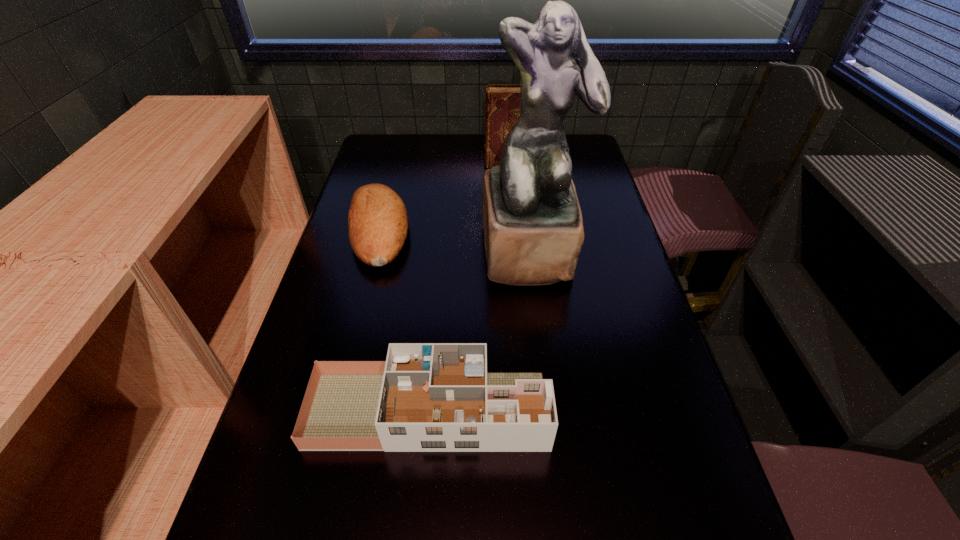
This screenshot has height=540, width=960. I want to click on vacant space located 0.260m on the back of the bread, so click(x=398, y=155).

In order to click on object that is at the far edge in this screenshot , I will do `click(503, 107)`.

I want to click on dollhouse situated at the left edge, so click(x=426, y=397).

Image resolution: width=960 pixels, height=540 pixels. Find the location of `bread that is at the left edge`. bread that is at the left edge is located at coordinates (377, 220).

This screenshot has width=960, height=540. Identify the location of object that is at the right edge. (533, 228).

Locate an element on the screen. free space at the far edge is located at coordinates (430, 166).

Where is `free spot at the left edge of the desktop`? The image size is (960, 540). free spot at the left edge of the desktop is located at coordinates pyautogui.click(x=356, y=336).

What are the coordinates of `free space at the right edge of the desktop` in the screenshot? It's located at (585, 266).

Identify the location of free region at the far left corner of the desktop. (392, 137).

Image resolution: width=960 pixels, height=540 pixels. In the image, there is a desktop. Find the location of `vacant space at the far right corner`. vacant space at the far right corner is located at coordinates (575, 138).